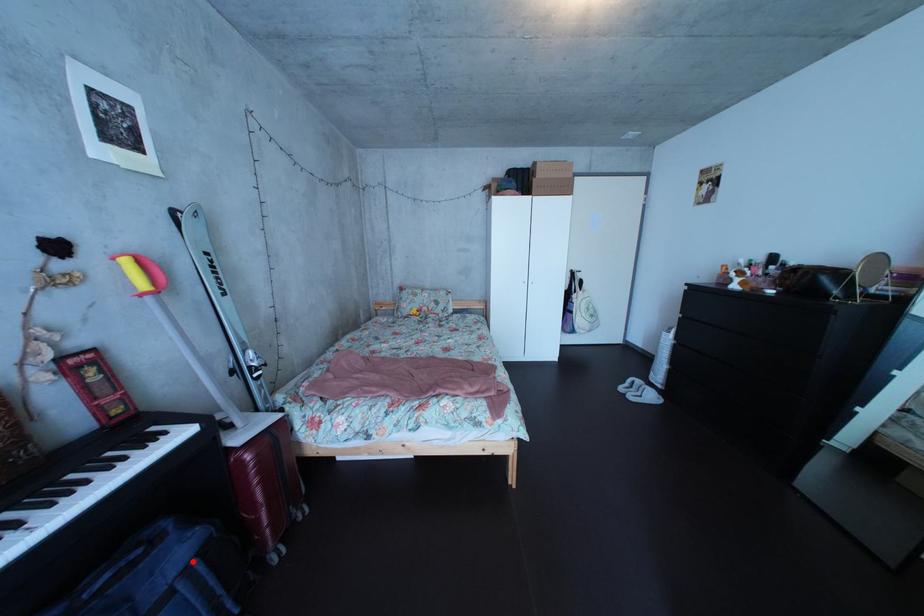
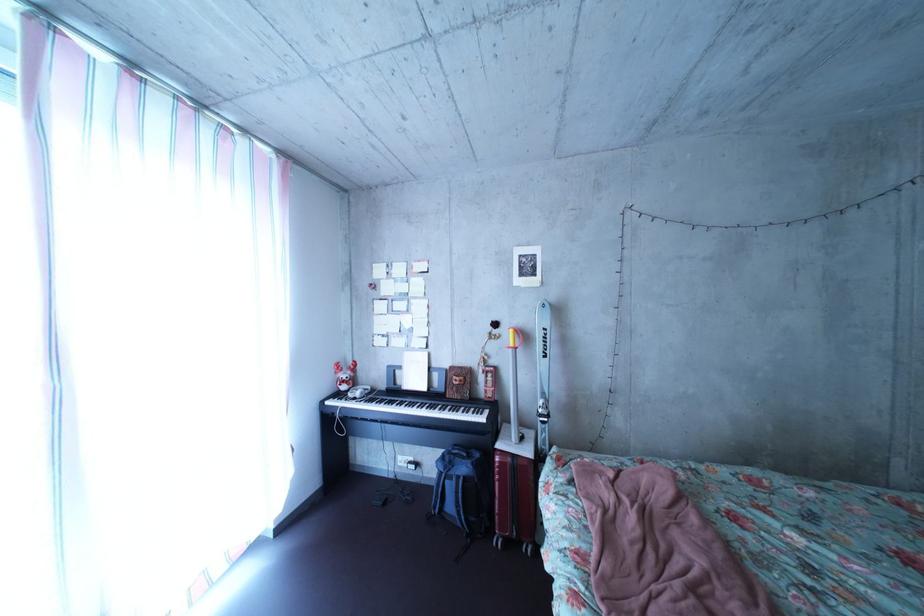
Question: I am providing you with two images of the same scene from different viewpoints. A red point is shown in image1. For the corresponding object point in image2, is it positioned nearer or farther from the camera?

Choices:
 (A) Nearer
 (B) Farther

Answer: (B)